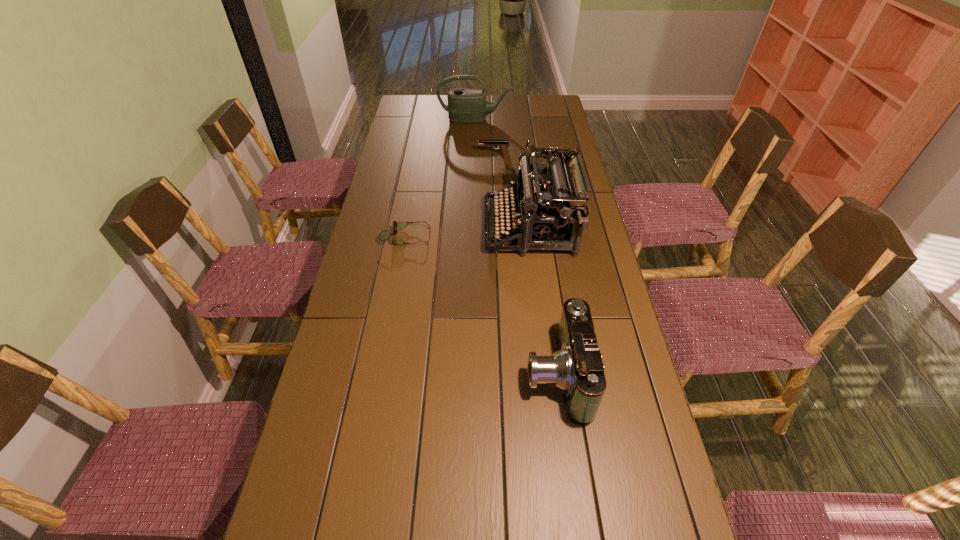
At what (x,y) coordinates should I click in order to perform the action: click on typewriter. Please return your answer as a coordinate pair (x, y). The width and height of the screenshot is (960, 540). Looking at the image, I should click on (555, 212).

You are a GUI agent. You are given a task and a screenshot of the screen. Output one action in this format:
    pyautogui.click(x=<x>, y=<y>)
    Task: Click on the second tallest object
    Image resolution: width=960 pixels, height=540 pixels.
    Given the screenshot: What is the action you would take?
    pyautogui.click(x=464, y=105)

The width and height of the screenshot is (960, 540). I want to click on watering can, so click(x=464, y=105).

Where is `the third tallest object`? the third tallest object is located at coordinates (576, 368).

Where is `camcorder`? This screenshot has width=960, height=540. camcorder is located at coordinates [576, 368].

Locate an element on the screen. This screenshot has height=540, width=960. the fourth nearest object is located at coordinates (502, 144).

At what (x,y) coordinates should I click in order to perform the action: click on the second shortest object. Please return your answer as a coordinate pair (x, y). The width and height of the screenshot is (960, 540). Looking at the image, I should click on (502, 144).

Find the location of a particular element. spectacles is located at coordinates (384, 235).

I want to click on vacant space located on the typing side of the typewriter, so click(387, 227).

Where is `vacant space located on the typing side of the typewriter`? vacant space located on the typing side of the typewriter is located at coordinates (387, 227).